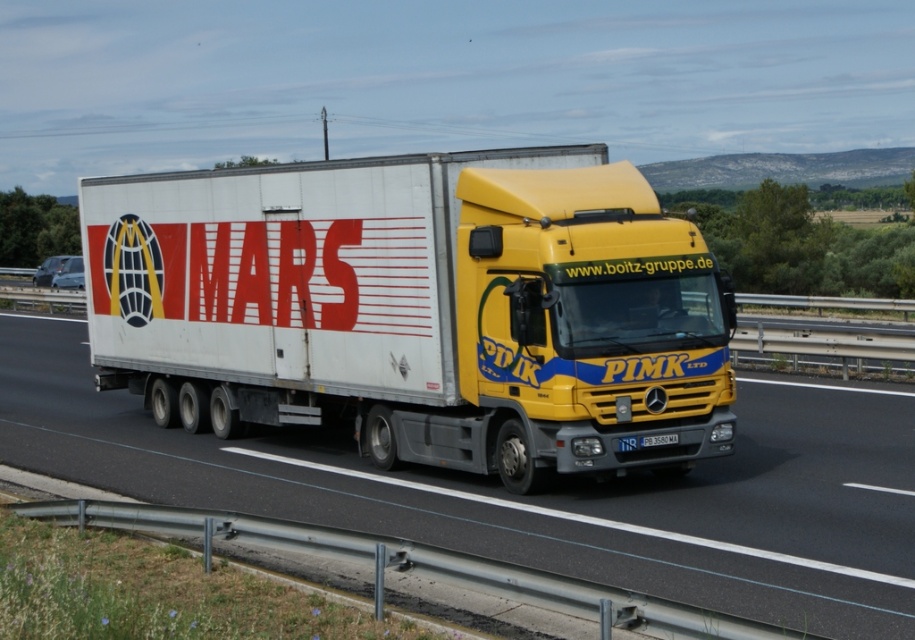
You are a drone operator controlling a drone that needs to capture aerial footage of the truck. You have two points marked on your map for the drone to fly to. The first point is point (105, 232) and the second is point (644, 442). Which point should you fly to first to ensure the drone captures the truck from behind?

Point (105, 232) is behind point (644, 442), so you should fly to point (105, 232) first to capture the truck from behind.

You are a traffic officer observing a large commercial truck on a highway. You notice the white matte truck at center and the white plastic license plate at center. Which object is taller?

The white matte truck at center is taller than the white plastic license plate at center according to the description.

You are a traffic officer observing a large commercial truck on a highway. The truck has a white matte trailer at center and a white matte truck at center. Which part of the vehicle is larger in size?

The white matte trailer at center is bigger than the white matte truck at center.